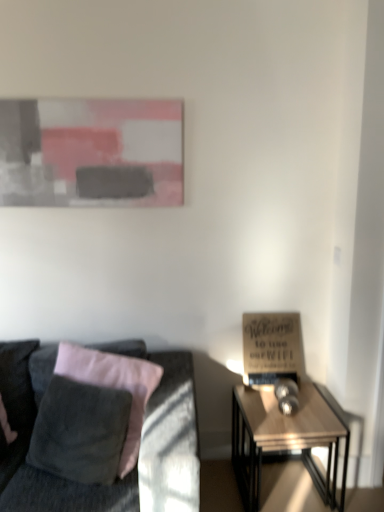
Image resolution: width=384 pixels, height=512 pixels. I want to click on blank space situated above matte gray painting at upper center (from a real-world perspective), so 77,94.